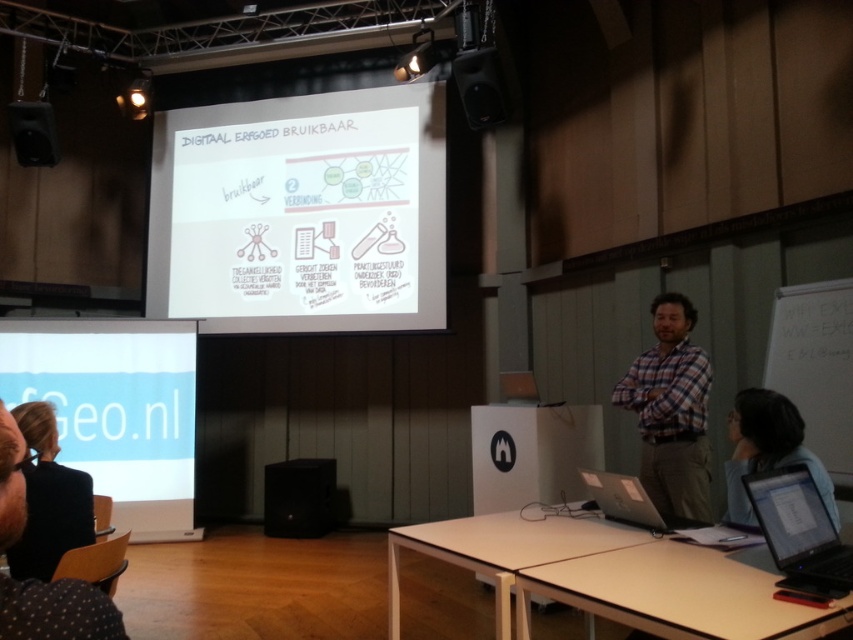
Who is taller, white paper at center or white wood table at lower center?

With more height is white paper at center.

Who is higher up, white paper at center or white wood table at lower center?

white paper at center is above.

At what (x,y) coordinates should I click in order to perform the action: click on white paper at center. Please return your answer as a coordinate pair (x, y). Looking at the image, I should click on (300, 212).

Between white paper at left and plaid fabric shirt at center, which one appears on the right side from the viewer's perspective?

plaid fabric shirt at center

In the scene shown: Does white paper at left appear on the left side of plaid fabric shirt at center?

Indeed, white paper at left is positioned on the left side of plaid fabric shirt at center.

The image size is (853, 640). Find the location of `white paper at left`. white paper at left is located at coordinates 115,410.

At what (x,y) coordinates should I click in order to perform the action: click on white paper at left. Please return your answer as a coordinate pair (x, y). The height and width of the screenshot is (640, 853). Looking at the image, I should click on (115, 410).

Who is positioned more to the left, white paper at left or black glossy laptop at lower right?

Positioned to the left is white paper at left.

Is point (16, 362) in front of point (849, 552)?

No, (16, 362) is behind (849, 552).

Is point (131, 374) closer to viewer compared to point (836, 566)?

No, (131, 374) is further to viewer.

You are a GUI agent. You are given a task and a screenshot of the screen. Output one action in this format:
    pyautogui.click(x=<x>, y=<y>)
    Task: Click on the white paper at left
    This screenshot has height=640, width=853.
    Given the screenshot: What is the action you would take?
    pyautogui.click(x=115, y=410)